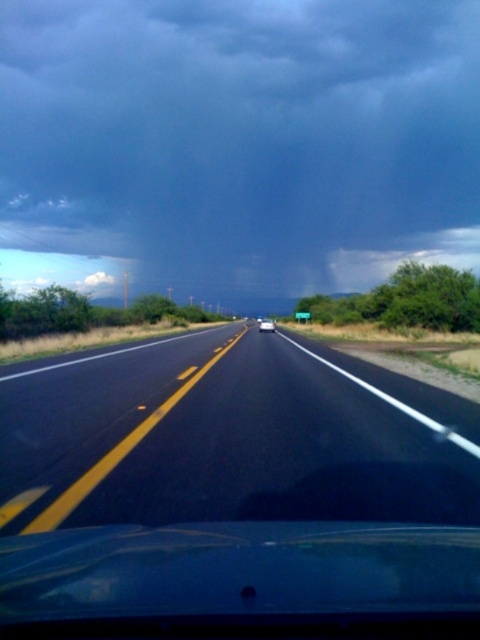
Based on the photo, you are driving a car that is 5 meters long and need to overtake the white glossy sedan at center. The black asphalt highway at center has a double yellow line. Can you safely overtake the sedan within the next 50 meters?

The distance between the black asphalt highway at center and white glossy sedan at center is 48.39 meters. Since your car is 5 meters long and the required distance to overtake safely is typically longer than the sum of both vehicles, you cannot safely overtake within the next 50 meters because 48.39 meters is less than the needed distance.

You are driving a car and see the black asphalt highway at center and the white glossy sedan at center ahead. Which object is closer to you?

The white glossy sedan at center is closer because the black asphalt highway at center is in front of it, meaning the highway is farther away.